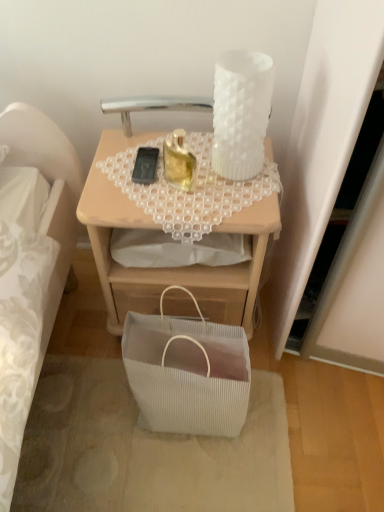
Where is `free point above matte wooden desk at center (from a real-world perspective)`? The image size is (384, 512). free point above matte wooden desk at center (from a real-world perspective) is located at coordinates (170, 185).